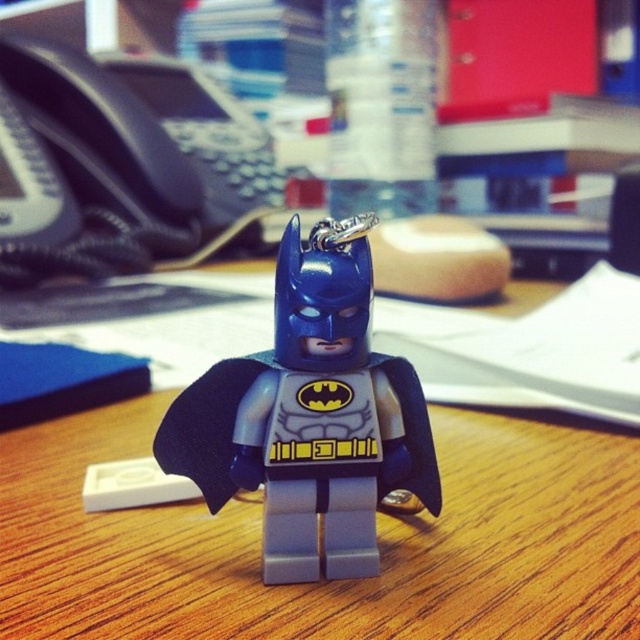
Between wooden desk at center and matte plastic batman keychain at center, which one appears on the left side from the viewer's perspective?

wooden desk at center

Is wooden desk at center to the left of matte plastic batman keychain at center from the viewer's perspective?

Correct, you'll find wooden desk at center to the left of matte plastic batman keychain at center.

Who is more forward, [224,600] or [273,579]?

Point [224,600] is in front.

I want to click on wooden desk at center, so click(378, 538).